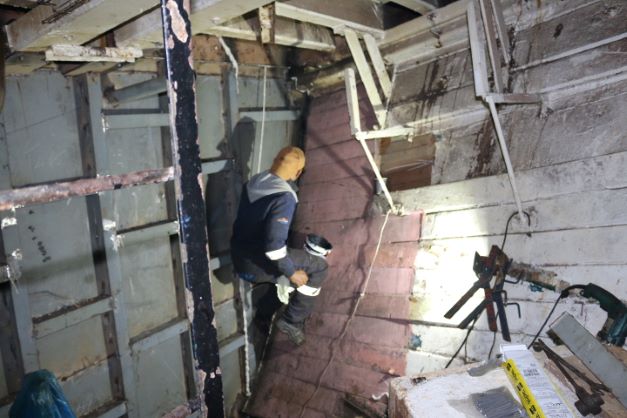
I want to click on light, so click(482, 262).